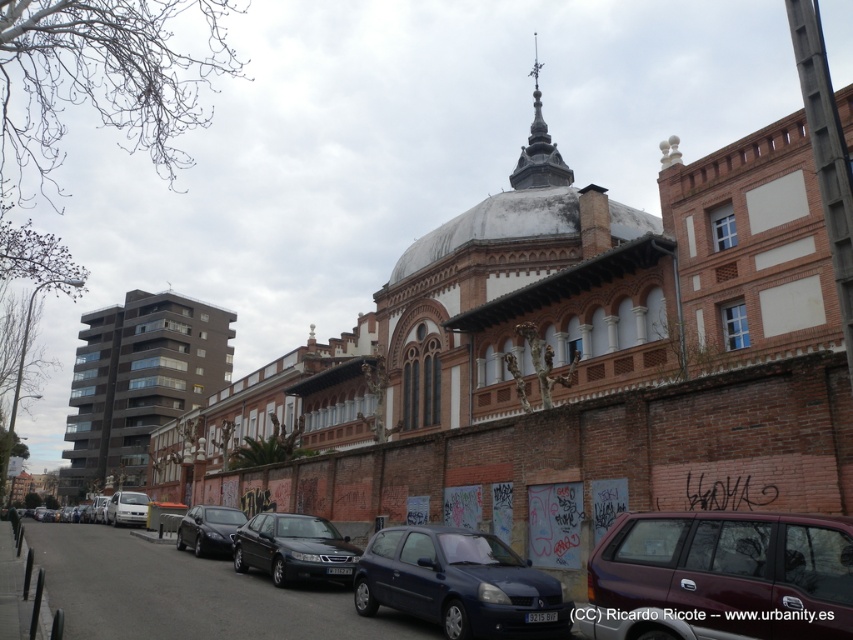
Question: In this image, where is satin black sedan at center located relative to shiny black sedan at center?

Choices:
 (A) above
 (B) below

Answer: (A)

Question: Which point appears closest to the camera in this image?

Choices:
 (A) (741, 515)
 (B) (440, 540)

Answer: (A)

Question: Which point is farther from the camera taking this photo?

Choices:
 (A) (200, 548)
 (B) (627, 596)

Answer: (A)

Question: From the image, what is the correct spatial relationship of shiny black sedan at center in relation to white matte van at lower left?

Choices:
 (A) right
 (B) left

Answer: (A)

Question: Does satin black sedan at center have a smaller size compared to dark gray stone spire at upper center?

Choices:
 (A) yes
 (B) no

Answer: (A)

Question: Which point appears farthest from the camera in this image?

Choices:
 (A) (186, 531)
 (B) (515, 177)
 (C) (654, 608)

Answer: (B)